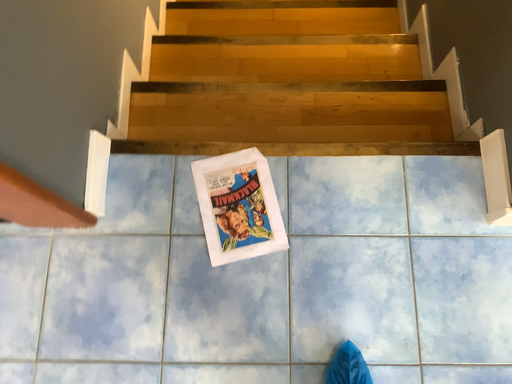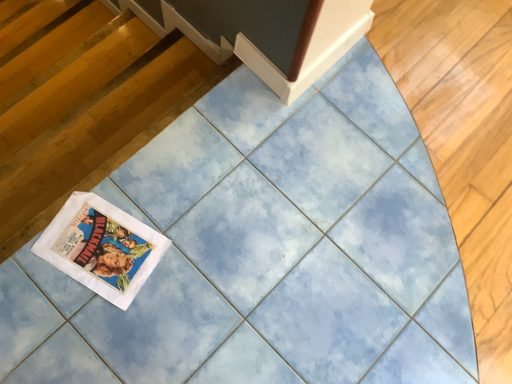
Question: How did the camera likely rotate when shooting the video?

Choices:
 (A) rotated left
 (B) rotated right

Answer: (B)